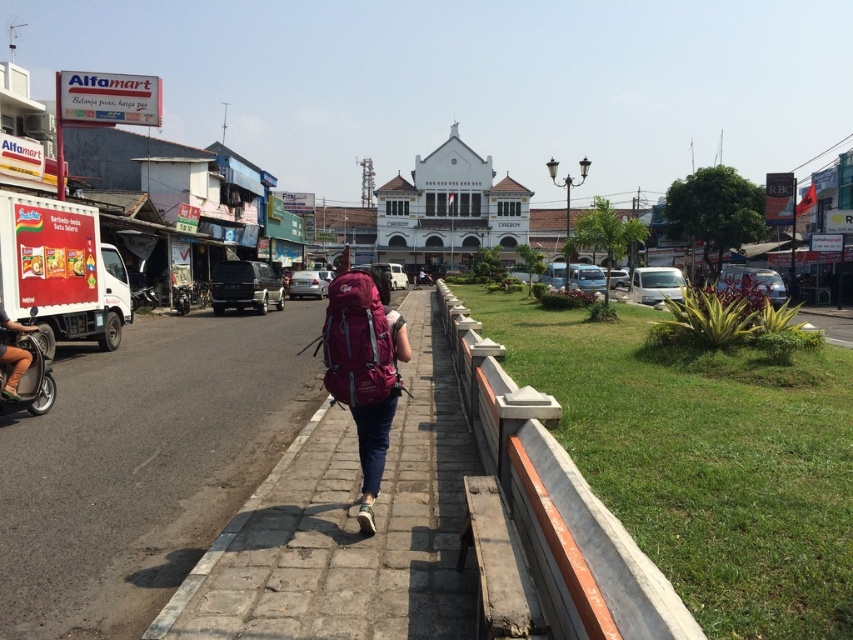
You are standing on the sidewalk and want to cross the road to reach the shops on the other side. The concrete at center is part of the low wall you need to step over. Can you safely step over it if your maximum step height is 0.6 meters?

The concrete at center has orange accents and is part of the low wall. Since its height isn

You are a delivery person who needs to pack both the purple fabric backpack at center and the denim shorts at left into a storage box. Based on their sizes, which item should you place first to optimize space?

The purple fabric backpack at center has a smaller size compared to denim shorts at left, so you should place the denim shorts at left first to optimize space by placing larger items first.

You are a delivery person trying to navigate through the sidewalk. You see the concrete at center and denim shorts at left. Which object takes up more horizontal space in the image?

The concrete at center takes up more horizontal space than the denim shorts at left because its width surpasses the denim shorts at left.